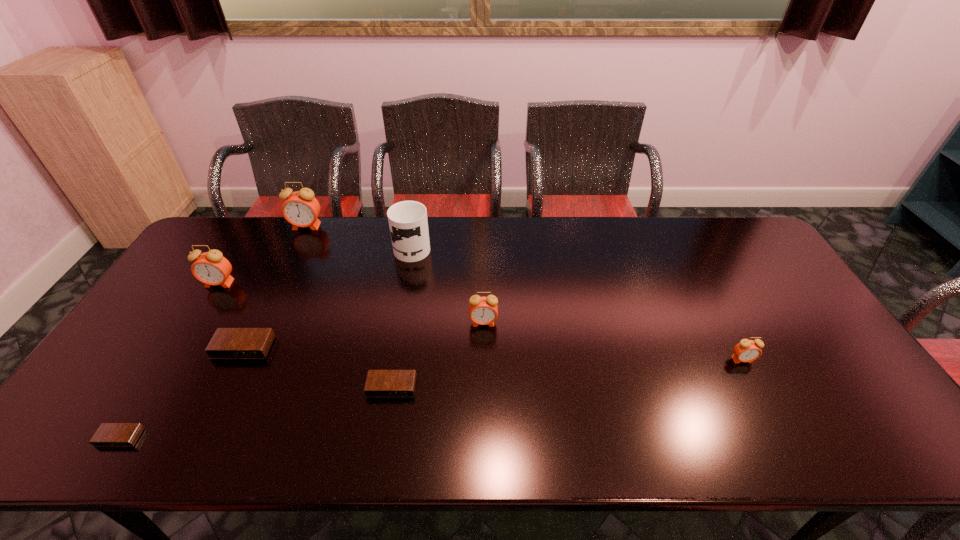
Where is `vacant space at the far left corner of the desktop`? vacant space at the far left corner of the desktop is located at coordinates (226, 226).

Identify the location of empty space that is in between the second biggest pink alarm clock and the mug. The width and height of the screenshot is (960, 540). [316, 265].

This screenshot has height=540, width=960. What are the coordinates of `vacant area that lies between the sixth nearest alarm clock and the seventh nearest object` in the screenshot? It's located at (316, 265).

At what (x,y) coordinates should I click in order to perform the action: click on free space between the nearest pink alarm clock and the second farthest object. Please return your answer as a coordinate pair (x, y). The height and width of the screenshot is (540, 960). Looking at the image, I should click on (577, 303).

The height and width of the screenshot is (540, 960). What are the coordinates of `vacant area that lies between the second nearest object and the second nearest pink alarm clock` in the screenshot? It's located at (438, 355).

Locate an element on the screen. The image size is (960, 540). vacant point located between the smallest pink alarm clock and the second nearest black alarm clock is located at coordinates (566, 373).

Where is `free space between the fifth shortest object and the fourth shortest object`? The height and width of the screenshot is (540, 960). free space between the fifth shortest object and the fourth shortest object is located at coordinates pyautogui.click(x=612, y=341).

Locate an element on the screen. empty space that is in between the smallest black alarm clock and the biggest pink alarm clock is located at coordinates (213, 332).

At what (x,y) coordinates should I click in order to perform the action: click on free area in between the fifth alarm clock from left to right and the nearest pink alarm clock. Please return your answer as a coordinate pair (x, y). Looking at the image, I should click on (566, 373).

At what (x,y) coordinates should I click in order to perform the action: click on free space between the third shortest object and the second farthest alarm clock. Please return your answer as a coordinate pair (x, y). Looking at the image, I should click on (231, 315).